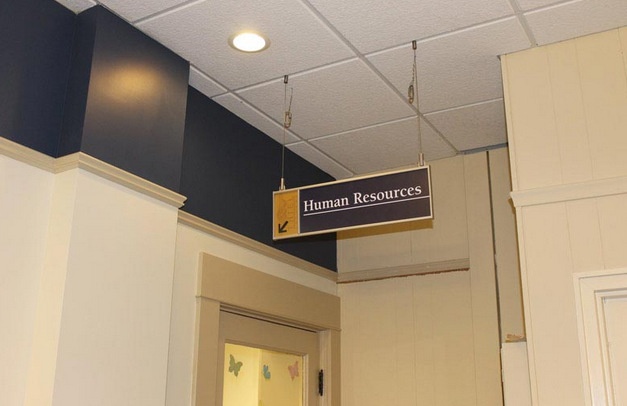
The width and height of the screenshot is (627, 406). In order to click on recessed lighting in this screenshot , I will do `click(241, 44)`, `click(233, 44)`.